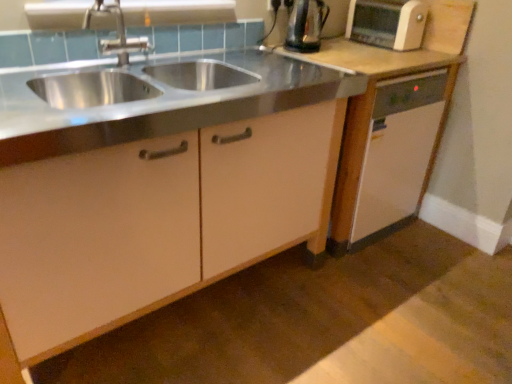
Question: Is brushed metal faucet at upper left shorter than matte white cabinet at center, marked as the second cabinetry in a right-to-left arrangement?

Choices:
 (A) no
 (B) yes

Answer: (B)

Question: Is brushed metal faucet at upper left facing towards matte white cabinet at center, marked as the second cabinetry in a right-to-left arrangement?

Choices:
 (A) yes
 (B) no

Answer: (A)

Question: Are brushed metal faucet at upper left and matte white cabinet at center, marked as the second cabinetry in a right-to-left arrangement, beside each other?

Choices:
 (A) no
 (B) yes

Answer: (A)

Question: From the image's perspective, is brushed metal faucet at upper left below matte white cabinet at center, which ranks as the 1th cabinetry in left-to-right order?

Choices:
 (A) no
 (B) yes

Answer: (A)

Question: Is matte white cabinet at center, which ranks as the 1th cabinetry in left-to-right order, at the back of brushed metal faucet at upper left?

Choices:
 (A) yes
 (B) no

Answer: (A)

Question: Considering their positions, is white plastic electric outlet at center located in front of or behind white plastic toaster at upper right?

Choices:
 (A) behind
 (B) front

Answer: (A)

Question: Considering the positions of white plastic electric outlet at center and white plastic toaster at upper right in the image, is white plastic electric outlet at center wider or thinner than white plastic toaster at upper right?

Choices:
 (A) wide
 (B) thin

Answer: (B)

Question: Does point (268, 1) appear closer or farther from the camera than point (359, 19)?

Choices:
 (A) closer
 (B) farther

Answer: (A)

Question: From the image's perspective, is white plastic electric outlet at center positioned above or below white plastic toaster at upper right?

Choices:
 (A) below
 (B) above

Answer: (B)

Question: Does point (103, 49) appear closer or farther from the camera than point (271, 3)?

Choices:
 (A) farther
 (B) closer

Answer: (B)

Question: From a real-world perspective, is brushed metal faucet at upper left above or below white plastic electric outlet at center?

Choices:
 (A) above
 (B) below

Answer: (B)

Question: Do you think brushed metal faucet at upper left is within white plastic electric outlet at center, or outside of it?

Choices:
 (A) outside
 (B) inside

Answer: (A)

Question: Visually, is brushed metal faucet at upper left positioned to the left or to the right of white plastic electric outlet at center?

Choices:
 (A) left
 (B) right

Answer: (A)

Question: Looking at their shapes, would you say brushed metal faucet at upper left is wider or thinner than white plastic toaster at upper right?

Choices:
 (A) thin
 (B) wide

Answer: (A)

Question: Considering the positions of point (120, 31) and point (414, 11), is point (120, 31) closer or farther from the camera than point (414, 11)?

Choices:
 (A) closer
 (B) farther

Answer: (A)